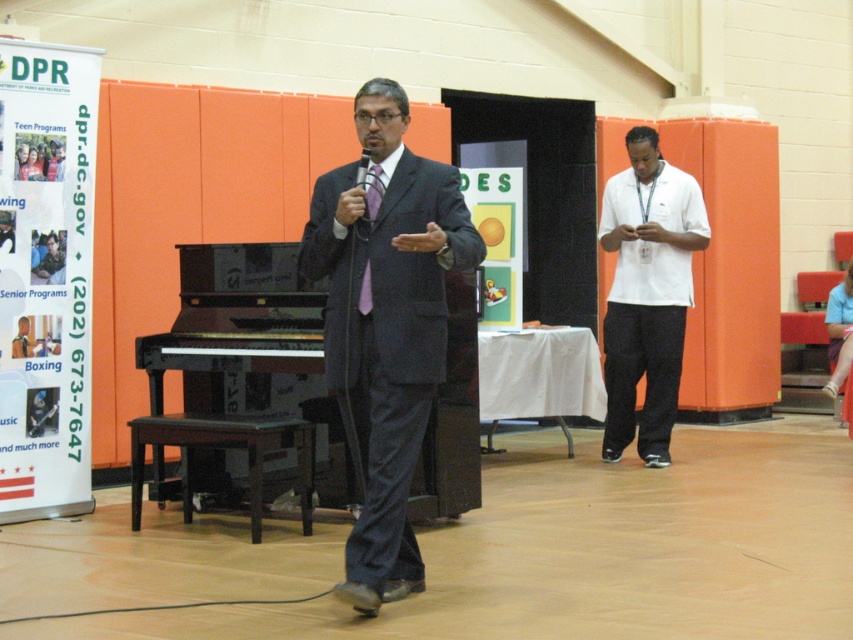
Based on the photo, you are standing at the point labeled point (663, 241) and want to move to the stage where the man in the dark suit is speaking. Is the point labeled point (346, 340) located between you and the stage?

Yes, the point labeled point (346, 340) is between you and the stage because it is in front of point (663, 241), which is your current position.

You are a photographer setting up for an event. You need to ensure that the matte black suit at center and the white cotton shirt at right are both visible in your shot. Given their sizes, which one might require more space in the frame to capture fully?

The matte black suit at center is wider than the white cotton shirt at right, so it would require more space in the frame to capture fully.